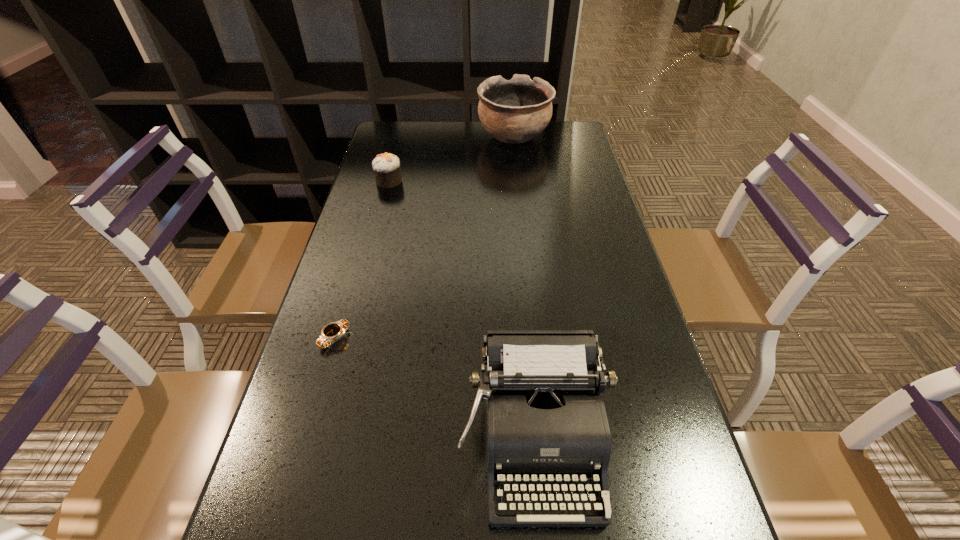
At what (x,y) coordinates should I click in order to perform the action: click on the farthest object. Please return your answer as a coordinate pair (x, y). Looking at the image, I should click on (514, 111).

This screenshot has width=960, height=540. I want to click on the tallest object, so click(x=514, y=111).

In order to click on the second tallest object in this screenshot , I will do `click(544, 421)`.

I want to click on the nearest object, so click(544, 421).

You are a GUI agent. You are given a task and a screenshot of the screen. Output one action in this format:
    pyautogui.click(x=<x>, y=<y>)
    Task: Click on the cupcake
    
    Given the screenshot: What is the action you would take?
    pyautogui.click(x=387, y=168)

Where is `the second shortest object`? This screenshot has height=540, width=960. the second shortest object is located at coordinates (387, 168).

Locate an element on the screen. The image size is (960, 540). the shortest object is located at coordinates (331, 332).

Locate an element on the screen. Image resolution: width=960 pixels, height=540 pixels. the second nearest object is located at coordinates (331, 332).

Find the location of a particular element. The height and width of the screenshot is (540, 960). free point located on the front of the tallest object is located at coordinates (518, 183).

This screenshot has height=540, width=960. In order to click on free spot located 0.050m on the front of the second shortest object in this screenshot , I will do `click(384, 198)`.